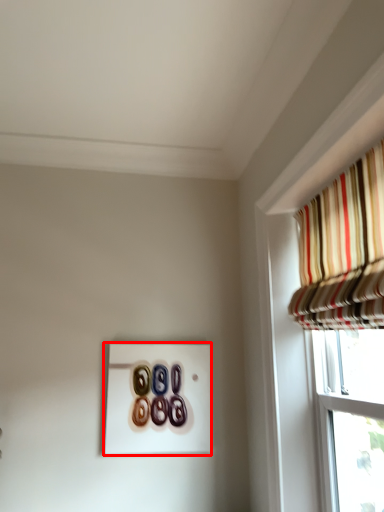
Question: Where is button (annotated by the red box) located in relation to curtain in the image?

Choices:
 (A) right
 (B) left

Answer: (B)